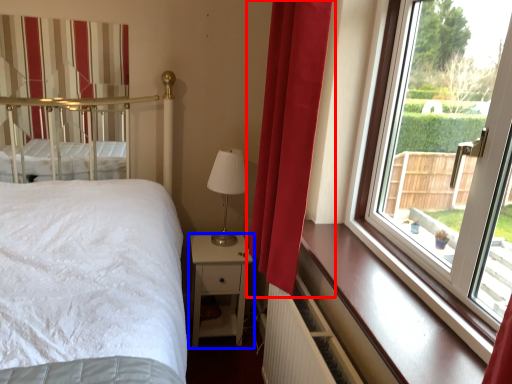
Question: Which of the following is the closest to the observer, curtain (highlighted by a red box) or nightstand (highlighted by a blue box)?

Choices:
 (A) curtain
 (B) nightstand

Answer: (A)